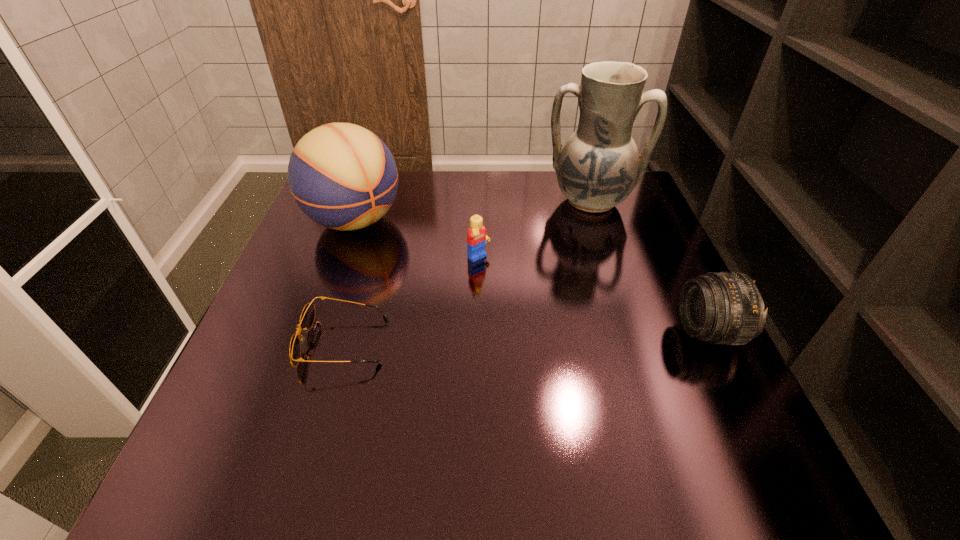
You are a GUI agent. You are given a task and a screenshot of the screen. Output one action in this format:
    pyautogui.click(x=<x>, y=<y>)
    Task: Click on the vacant region located 0.090m at the front element of the telephoto lens
    Image resolution: width=960 pixels, height=540 pixels.
    Given the screenshot: What is the action you would take?
    pyautogui.click(x=636, y=332)

Where is `vacant area situated on the face of the fourth tallest object`? vacant area situated on the face of the fourth tallest object is located at coordinates (557, 330).

Find the location of a particular element. vacant point located on the face of the fourth tallest object is located at coordinates (510, 288).

Image resolution: width=960 pixels, height=540 pixels. What are the coordinates of `vacant space located 0.230m on the face of the fourth tallest object` in the screenshot? It's located at (553, 327).

The image size is (960, 540). In order to click on free space located 0.120m on the patterned surface of the basketball in this screenshot , I will do (x=409, y=268).

Image resolution: width=960 pixels, height=540 pixels. I want to click on vacant space located on the patterned surface of the basketball, so click(397, 258).

In order to click on free spot located 0.060m on the patterned surface of the basketball in this screenshot , I will do `click(395, 255)`.

At what (x,y) coordinates should I click in order to perform the action: click on blank space located 0.380m on the front-facing side of the pitcher. Please return your answer as a coordinate pair (x, y). The height and width of the screenshot is (540, 960). Looking at the image, I should click on (572, 331).

This screenshot has height=540, width=960. I want to click on vacant point located 0.210m on the front-facing side of the pitcher, so click(x=579, y=275).

In order to click on vacant space located 0.200m on the front-facing side of the pitcher in this screenshot , I will do `click(579, 273)`.